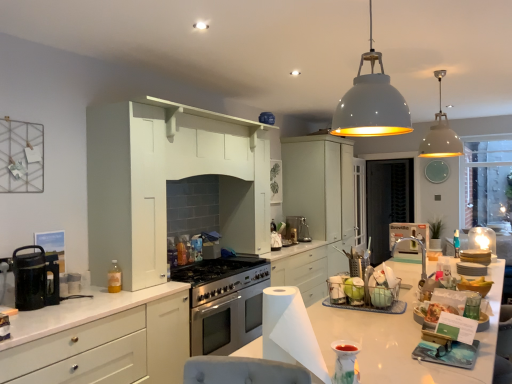
Question: From their relative heights in the image, would you say black glass coffee maker at left is taller or shorter than satin silver kettle at center, the 4th appliance from the right?

Choices:
 (A) tall
 (B) short

Answer: (A)

Question: From a real-world perspective, relative to satin silver kettle at center, which is the first appliance in back-to-front order, is black glass coffee maker at left vertically above or below?

Choices:
 (A) above
 (B) below

Answer: (A)

Question: Based on their relative distances, which object is farther from the porcelain vase at lower center, the first appliance viewed from the front?

Choices:
 (A) matte white cabinets at center, acting as the 1th cabinetry starting from the right
 (B) white matte stack of plates at right, placed as the fourth appliance when sorted from left to right
 (C) translucent plastic bottle at left
 (D) matte white container at center, the 5th appliance positioned from the back
 (E) black glass coffee maker at left

Answer: (A)

Question: Which of these objects is positioned farthest from the matte white cabinets at center, the second cabinetry in the front-to-back sequence?

Choices:
 (A) black mesh screen door at center
 (B) translucent plastic bottle at left
 (C) black glass coffee maker at left
 (D) clear glass cabinet at center
 (E) matte white container at center, the 5th appliance when ordered from right to left

Answer: (C)